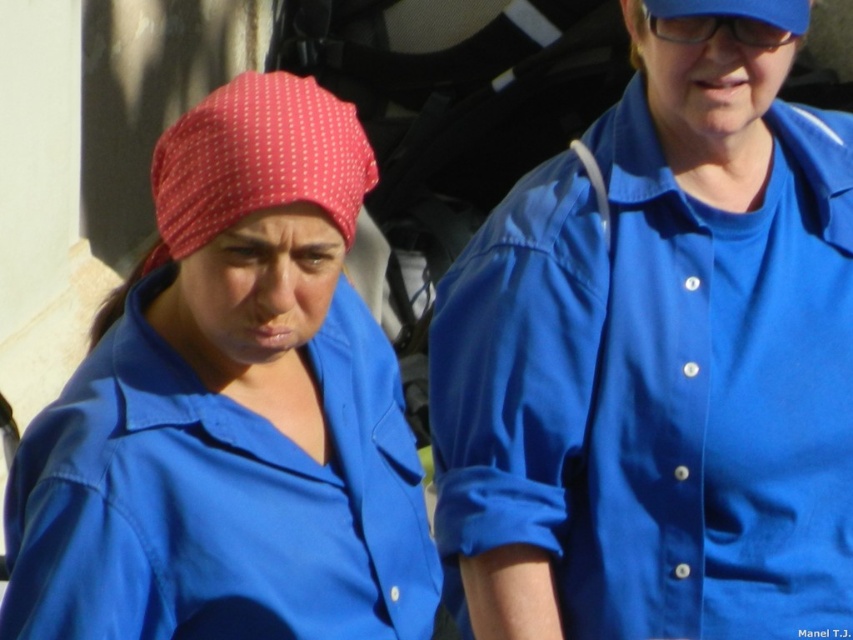
Question: Which point appears farthest from the camera in this image?

Choices:
 (A) (306, 436)
 (B) (680, 8)
 (C) (317, 182)

Answer: (B)

Question: Which point is closer to the camera taking this photo?

Choices:
 (A) (219, 573)
 (B) (746, 13)

Answer: (A)

Question: Is blue smooth shirt at center bigger than blue fabric baseball cap at upper right?

Choices:
 (A) no
 (B) yes

Answer: (B)

Question: Does blue smooth shirt at center have a larger size compared to red dotted fabric at left?

Choices:
 (A) yes
 (B) no

Answer: (A)

Question: Is matte blue shirt at center positioned before blue fabric baseball cap at upper right?

Choices:
 (A) yes
 (B) no

Answer: (A)

Question: Based on their relative distances, which object is farther from the red dotted fabric at left?

Choices:
 (A) matte blue shirt at center
 (B) blue fabric baseball cap at upper right

Answer: (B)